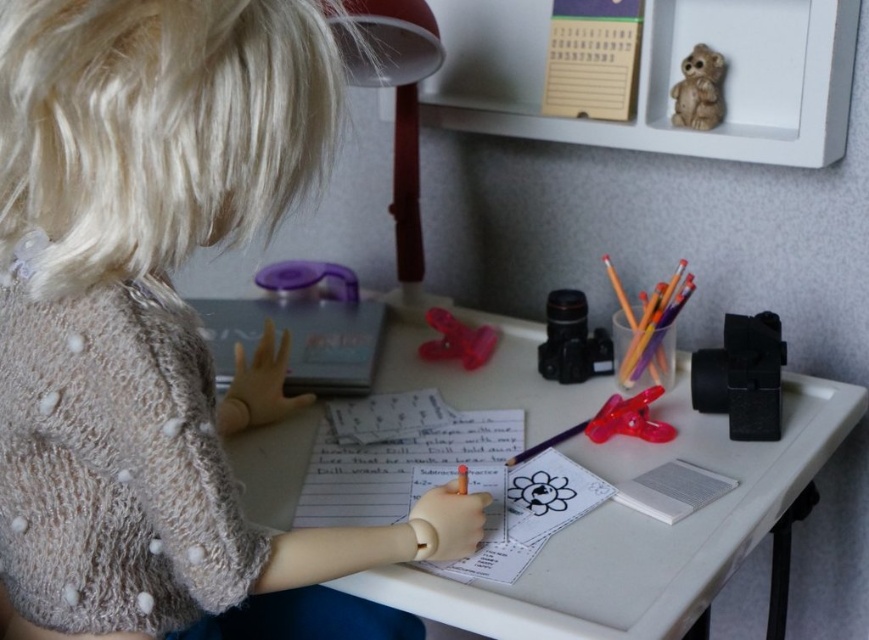
Who is lower down, knitted beige sweater at center or transparent plastic binder clip at center?

Positioned lower is transparent plastic binder clip at center.

Is point (12, 525) closer to viewer compared to point (615, 404)?

Yes, point (12, 525) is in front of point (615, 404).

The height and width of the screenshot is (640, 869). In order to click on knitted beige sweater at center in this screenshot , I will do `click(158, 323)`.

Is black plastic camera at center to the right of transparent plastic binder clip at center from the viewer's perspective?

No, black plastic camera at center is not to the right of transparent plastic binder clip at center.

Is black plastic camera at center taller than transparent plastic binder clip at center?

Indeed, black plastic camera at center has a greater height compared to transparent plastic binder clip at center.

Between point (585, 362) and point (659, 392), which one is positioned behind?

The point (585, 362) is more distant.

This screenshot has height=640, width=869. What are the coordinates of `black plastic camera at center` in the screenshot? It's located at (572, 340).

Does black plastic camera at center have a greater width compared to brown matte bear at upper right?

Yes.

Is black plastic camera at center to the right of brown matte bear at upper right from the viewer's perspective?

In fact, black plastic camera at center is to the left of brown matte bear at upper right.

Find the location of `black plastic camera at center`. black plastic camera at center is located at coordinates point(572,340).